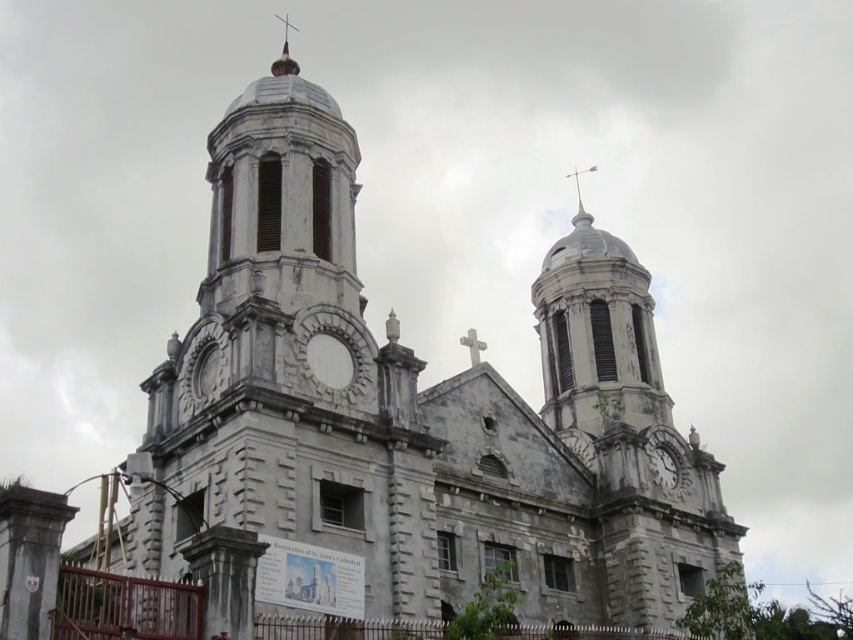
Based on the photo, you are an architect examining the church facade. You notice the white stone dome at upper center and the white stone clock at center. Which of these two objects is larger in size?

The white stone dome at upper center is bigger than the white stone clock at center.

You are a tourist standing in front of the historic church and want to take a photo that includes both the gray stone clock tower at center and the white stone spire at upper center. Which object should you focus on first to ensure both are in the frame?

You should focus on the gray stone clock tower at center first since it is larger in size compared to the white stone spire at upper center, making it easier to frame both objects in the photo.

You are a maintenance worker needing to inspect the white stone spire at upper center from the gray stone clock tower at center. Given that your ladder can extend up to 100 feet, will you be able to reach the spire from the clock tower?

The distance between the gray stone clock tower at center and the white stone spire at upper center is 139.59 feet, which exceeds the ladder extension limit of 100 feet. Therefore, the ladder will not be sufficient to reach the spire from the clock tower.